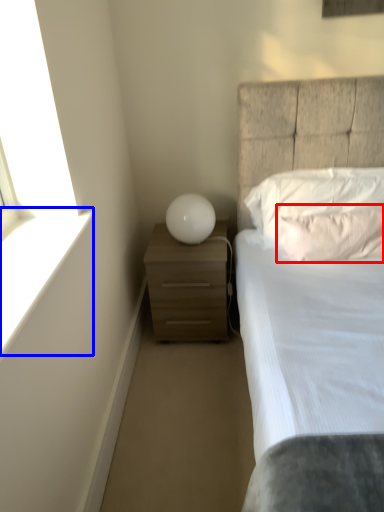
Question: Which of the following is the closest to the observer, pillow (highlighted by a red box) or window sill (highlighted by a blue box)?

Choices:
 (A) pillow
 (B) window sill

Answer: (B)